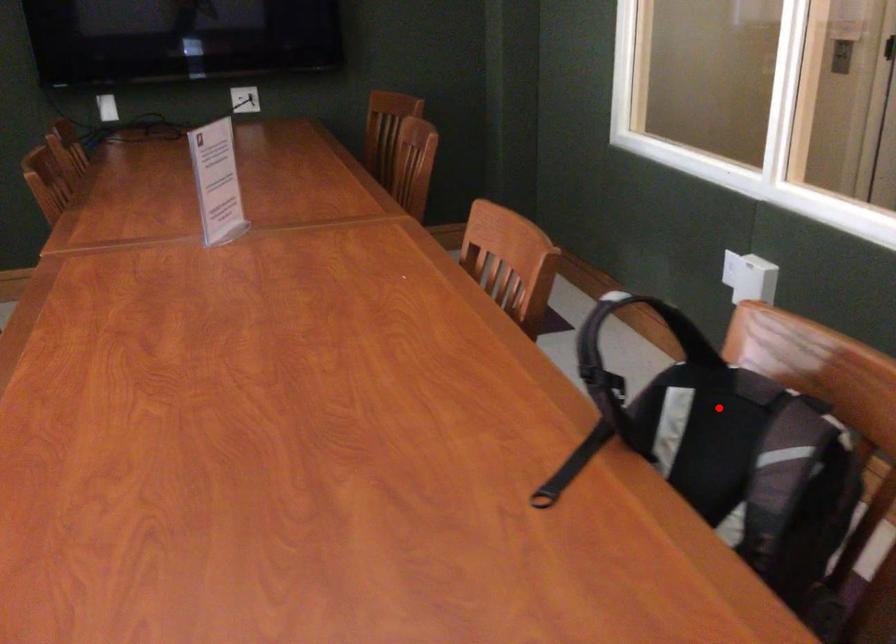
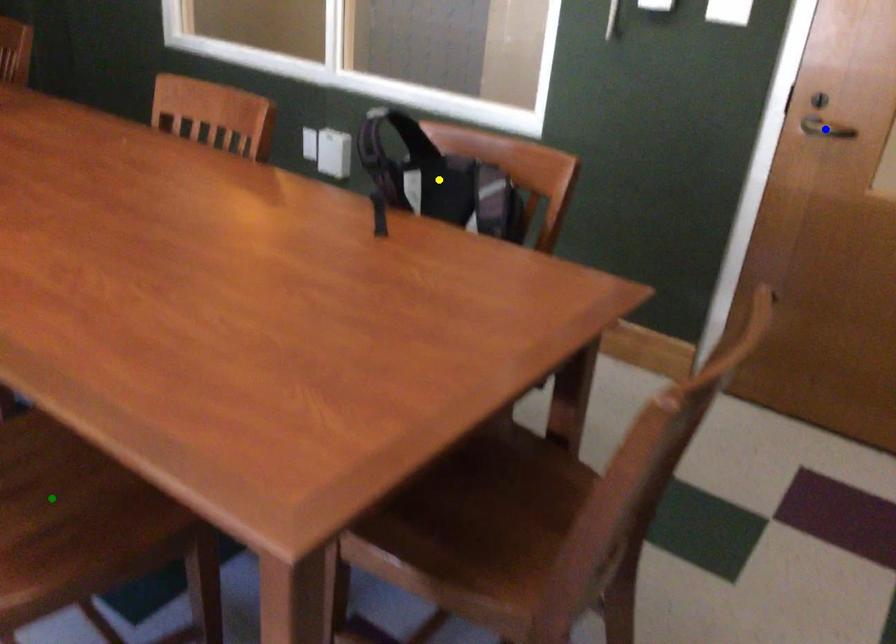
Question: I am providing you with two images of the same scene from different viewpoints. A red point is marked on the first image. You are given multiple points on the second image. Which mark in image 2 goes with the point in image 1?

Choices:
 (A) yellow point
 (B) green point
 (C) blue point

Answer: (A)